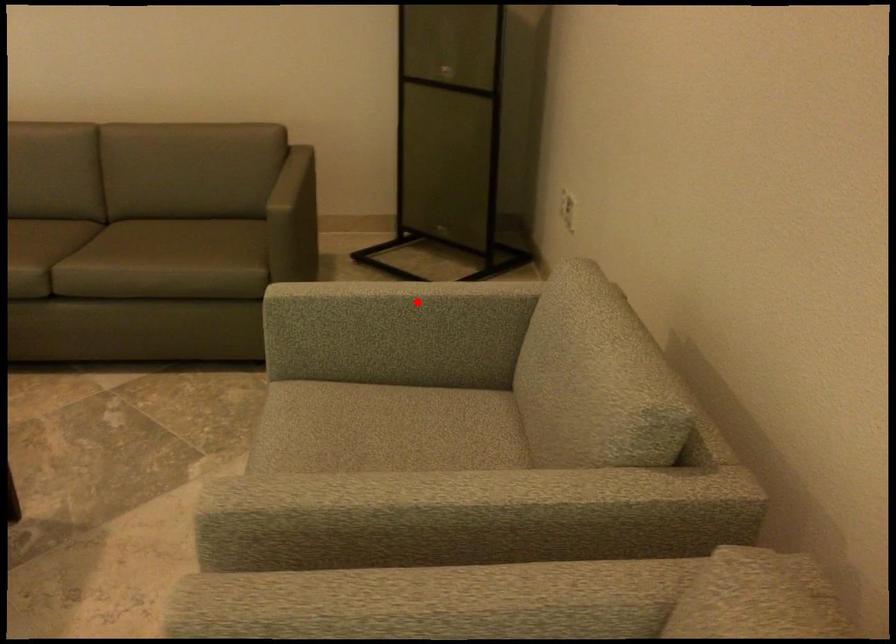
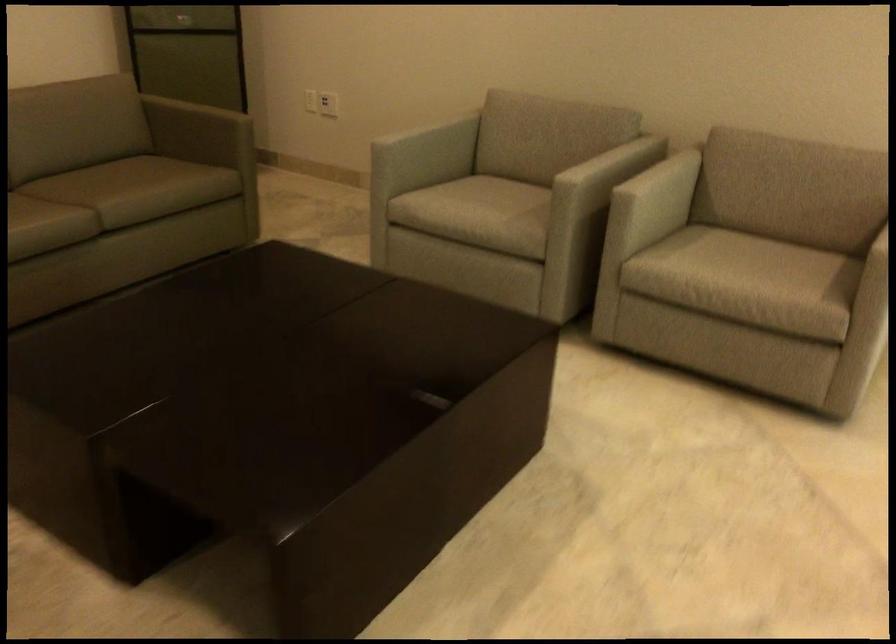
Question: A red point is marked in image1. In image2, is the corresponding 3D point closer to the camera or farther? Reply with the corresponding letter.

Choices:
 (A) The corresponding 3D point is closer.
 (B) The corresponding 3D point is farther.

Answer: (B)